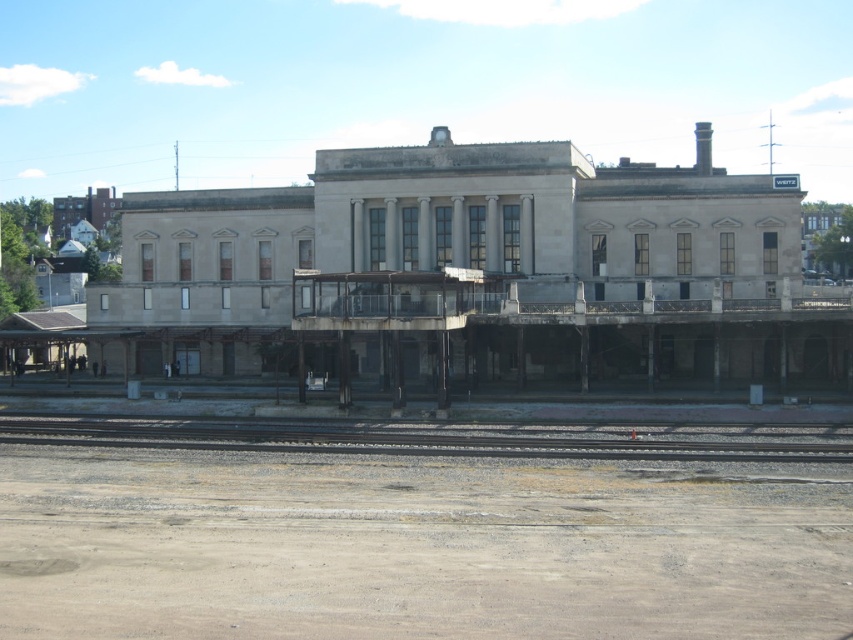
Question: Which point is farther to the camera?

Choices:
 (A) gray gravel train track at lower center
 (B) gray concrete railway station at center

Answer: (B)

Question: Does gray concrete railway station at center lie behind gray gravel train track at lower center?

Choices:
 (A) no
 (B) yes

Answer: (B)

Question: Does gray concrete railway station at center have a larger size compared to gray gravel train track at lower center?

Choices:
 (A) yes
 (B) no

Answer: (A)

Question: Does gray concrete railway station at center have a larger size compared to gray gravel train track at lower center?

Choices:
 (A) no
 (B) yes

Answer: (B)